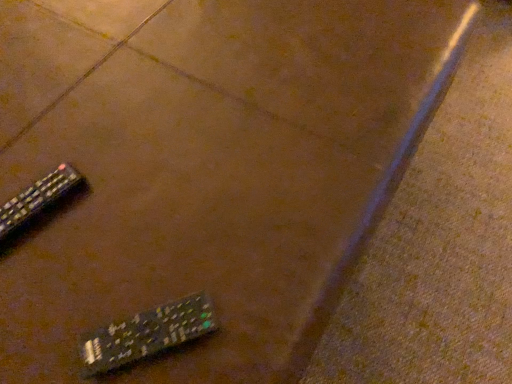
This screenshot has height=384, width=512. What are the coordinates of `unoccupied space behind black plastic remote at lower left, which is the second remote control from front to back` in the screenshot? It's located at (72, 118).